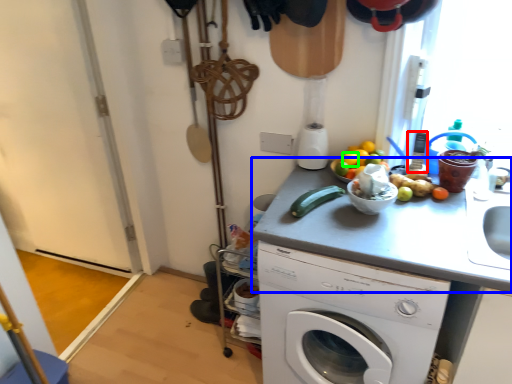
Question: Which object is the closest to the appliance (highlighted by a red box)? Choose among these: counter top (highlighted by a blue box) or orange (highlighted by a green box).

Choices:
 (A) counter top
 (B) orange

Answer: (B)